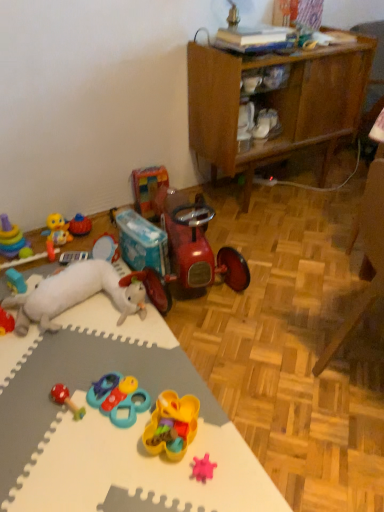
I want to click on spots to the right of white foam mat at lower left, so click(x=279, y=337).